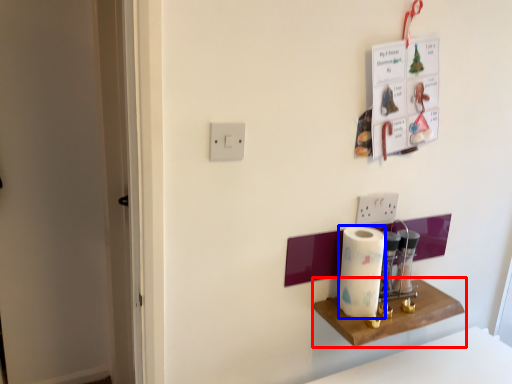
Question: Among these objects, which one is nearest to the camera, shelf (highlighted by a red box) or paper towel (highlighted by a blue box)?

Choices:
 (A) shelf
 (B) paper towel

Answer: (A)